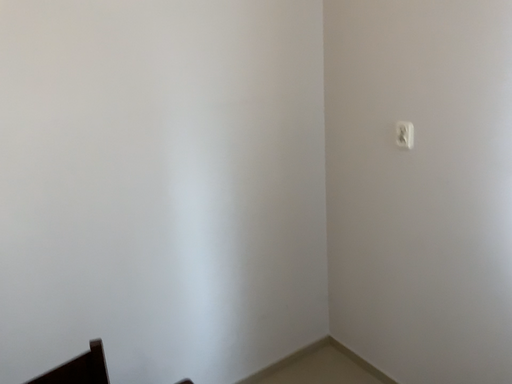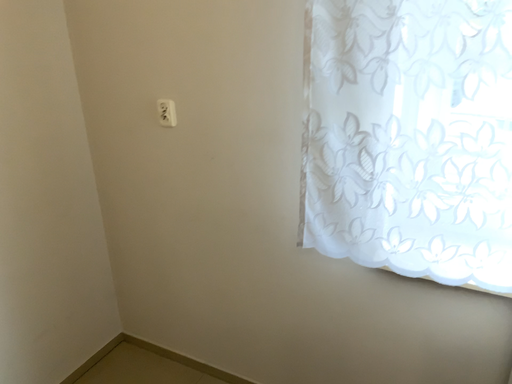
Question: Which way did the camera rotate in the video?

Choices:
 (A) rotated right
 (B) rotated left

Answer: (A)